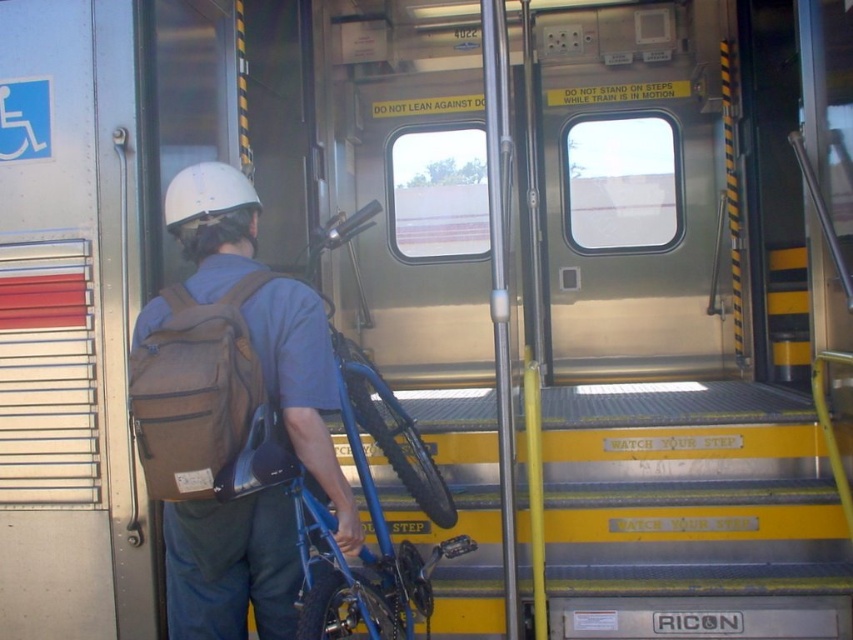
Consider the image. Who is more distant from viewer, (310,356) or (340,218)?

The point (340,218) is more distant.

Who is more forward, (152, 470) or (384, 628)?

Point (152, 470) is more forward.

In order to click on brown fabric backpack at left in this screenshot , I will do `click(230, 412)`.

Looking at this image, is brown fabric backpack at center thinner than brown fabric strap at back?

No.

Can you confirm if brown fabric backpack at center is positioned to the right of brown fabric strap at back?

Correct, you'll find brown fabric backpack at center to the right of brown fabric strap at back.

Is point (184, 365) positioned after point (187, 305)?

No, (184, 365) is in front of (187, 305).

I want to click on brown fabric backpack at center, so click(x=199, y=397).

This screenshot has height=640, width=853. What do you see at coordinates (230, 412) in the screenshot?
I see `brown fabric backpack at left` at bounding box center [230, 412].

Does point (354, 547) come farther from viewer compared to point (242, 451)?

That is True.

Identify the location of brown fabric backpack at left. (230, 412).